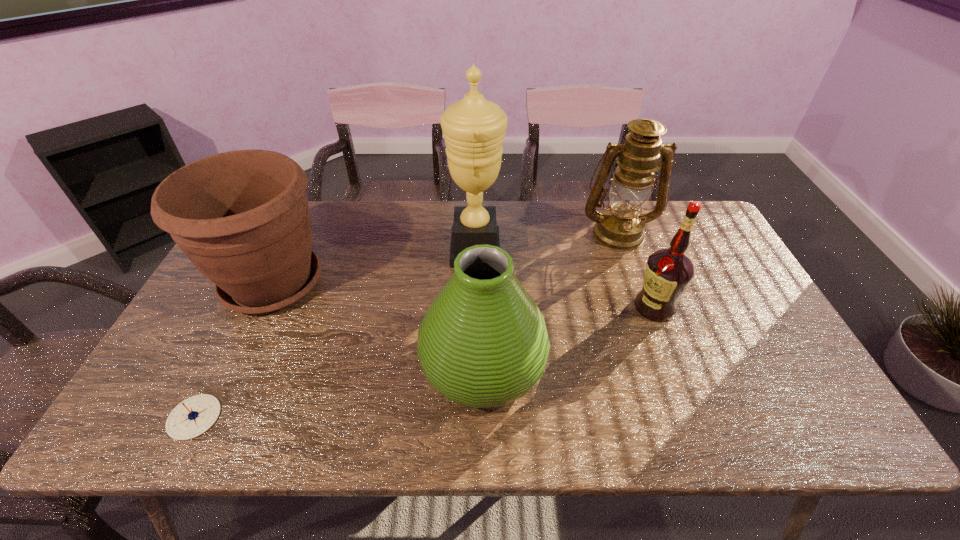
Locate an element on the screen. The image size is (960, 540). compass that is at the left edge is located at coordinates (192, 417).

In order to click on object situated at the far left corner in this screenshot , I will do `click(242, 217)`.

Find the location of a particular element. object at the near left corner is located at coordinates 192,417.

At what (x,y) coordinates should I click in order to perform the action: click on blank space at the far edge. Please return your answer as a coordinate pair (x, y). This screenshot has width=960, height=540. Looking at the image, I should click on (576, 230).

The width and height of the screenshot is (960, 540). Find the location of `vacant region at the near edge of the desktop`. vacant region at the near edge of the desktop is located at coordinates (530, 404).

You are a GUI agent. You are given a task and a screenshot of the screen. Output one action in this format:
    pyautogui.click(x=<x>, y=<y>)
    Task: Click on the vacant region at the left edge of the desktop
    This screenshot has height=540, width=960.
    Given the screenshot: What is the action you would take?
    pyautogui.click(x=192, y=322)

Locate an element on the screen. Image resolution: width=960 pixels, height=540 pixels. vacant space at the right edge of the desktop is located at coordinates (708, 248).

This screenshot has width=960, height=540. Identify the location of free space between the flowerpot and the tallest object. (374, 267).

Identify the location of free space between the alcohol and the oil lamp. The height and width of the screenshot is (540, 960). (636, 270).

At what (x,y) coordinates should I click in order to perform the action: click on empty location between the vase and the flowerpot. Please return your answer as a coordinate pair (x, y). Looking at the image, I should click on (378, 324).